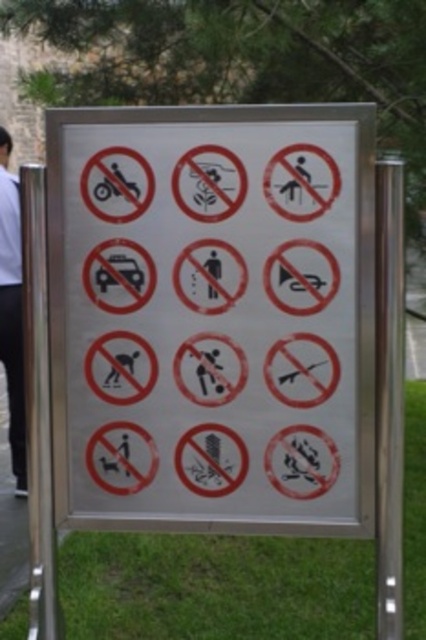
Question: Which point appears closest to the camera in this image?

Choices:
 (A) coord(160,145)
 (B) coord(16,216)

Answer: (A)

Question: In this image, where is white metallic signboard at center located relative to white shirt at left?

Choices:
 (A) above
 (B) below

Answer: (B)

Question: Among these objects, which one is farthest from the camera?

Choices:
 (A) white shirt at left
 (B) white metallic signboard at center

Answer: (A)

Question: Where is white metallic signboard at center located in relation to white shirt at left in the image?

Choices:
 (A) below
 (B) above

Answer: (A)

Question: Is white metallic signboard at center above white shirt at left?

Choices:
 (A) no
 (B) yes

Answer: (A)

Question: Which point is farther from the camera taking this photo?

Choices:
 (A) (20, 269)
 (B) (54, 170)

Answer: (A)